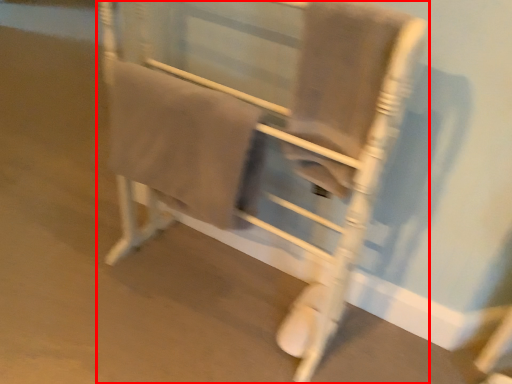
Question: From the image's perspective, where is furniture (annotated by the red box) located in relation to bath towel in the image?

Choices:
 (A) below
 (B) above

Answer: (A)